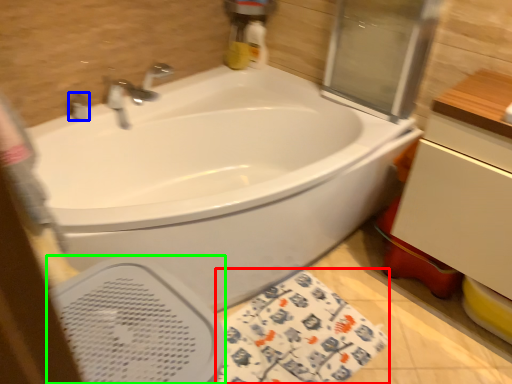
Question: Estimate the real-world distances between objects in this image. Which object is closer to beach towel (highlighted by a red box), plumbing fixture (highlighted by a blue box) or bidet (highlighted by a green box)?

Choices:
 (A) plumbing fixture
 (B) bidet

Answer: (B)